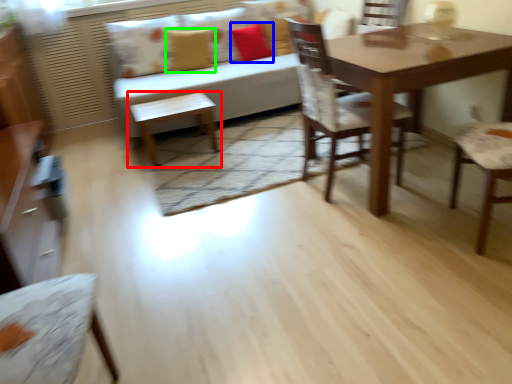
Question: Which object is positioned farthest from table (highlighted by a red box)? Select from pillow (highlighted by a blue box) and pillow (highlighted by a green box).

Choices:
 (A) pillow
 (B) pillow

Answer: (A)